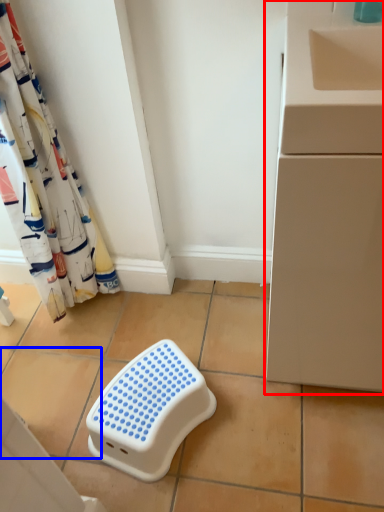
Question: Among these objects, which one is nearest to the camera, counter (highlighted by a red box) or ceramic tile (highlighted by a blue box)?

Choices:
 (A) counter
 (B) ceramic tile

Answer: (A)